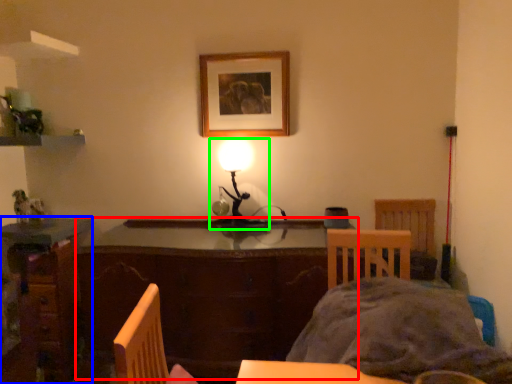
Question: Considering the real-world distances, which object is farthest from table (highlighted by a red box)? desk (highlighted by a blue box) or lamp (highlighted by a green box)?

Choices:
 (A) desk
 (B) lamp

Answer: (B)